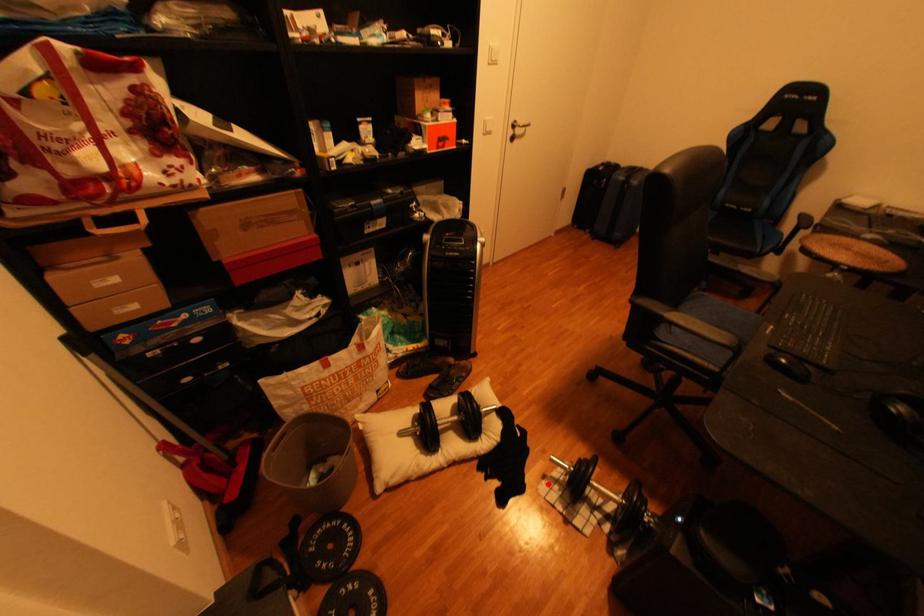
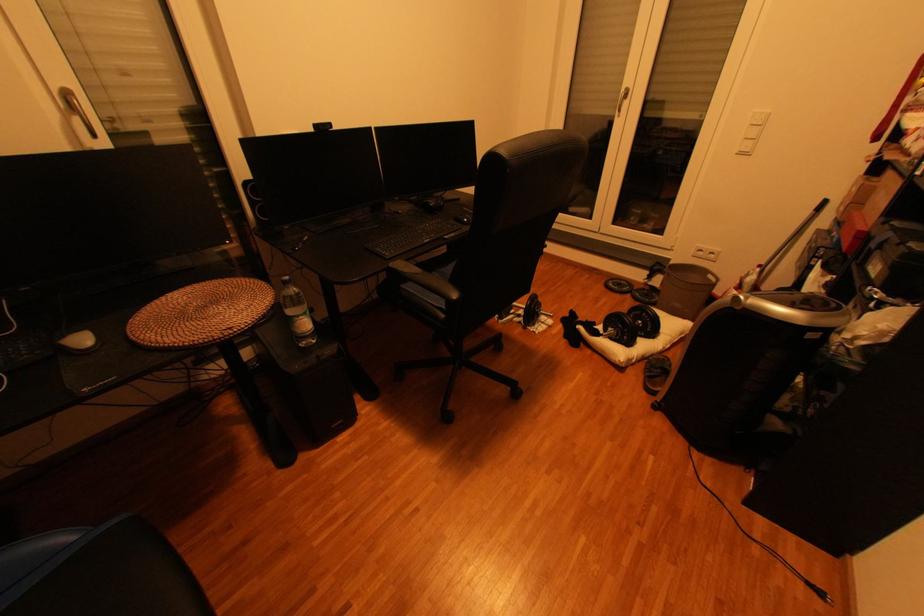
Find the pixel in the second image that matches the highlighted location in the first image.

(564, 323)